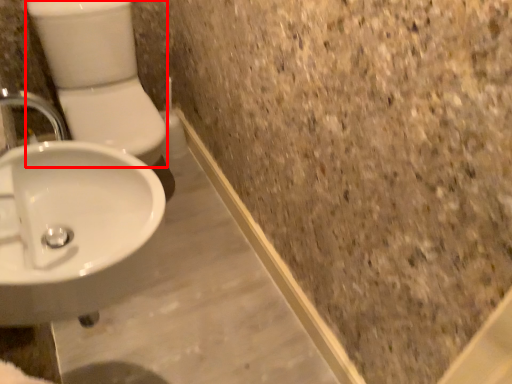
Question: Observing the image, what is the correct spatial positioning of toilet bowl (annotated by the red box) in reference to sink?

Choices:
 (A) right
 (B) left

Answer: (B)